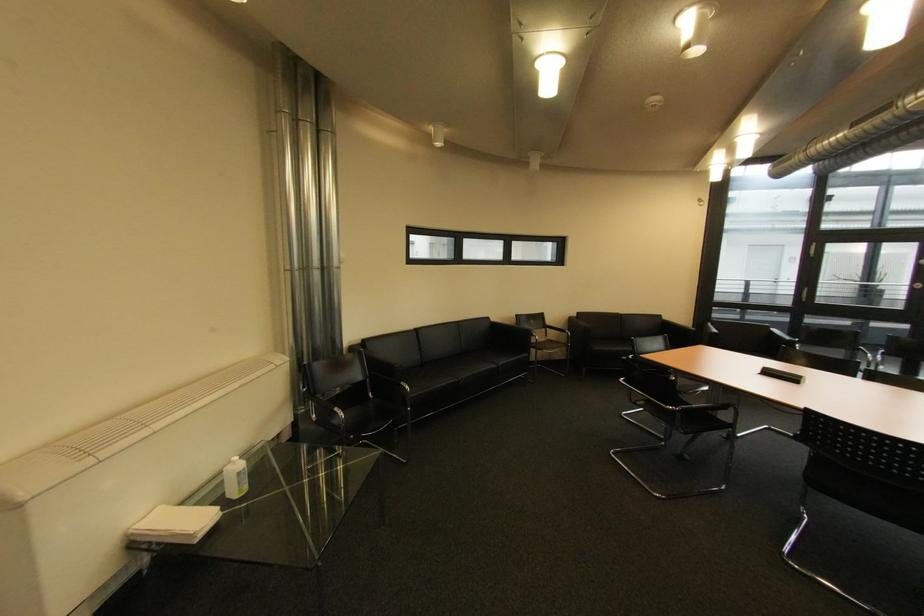
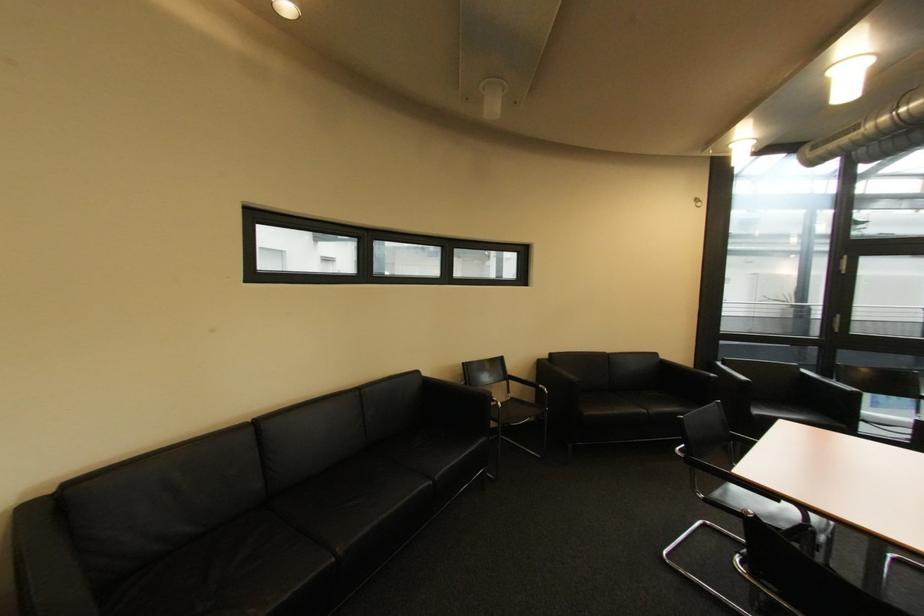
Question: In a continuous first-person perspective shot, in which direction is the camera moving?

Choices:
 (A) Left
 (B) Right
 (C) Forward
 (D) Backward

Answer: (C)